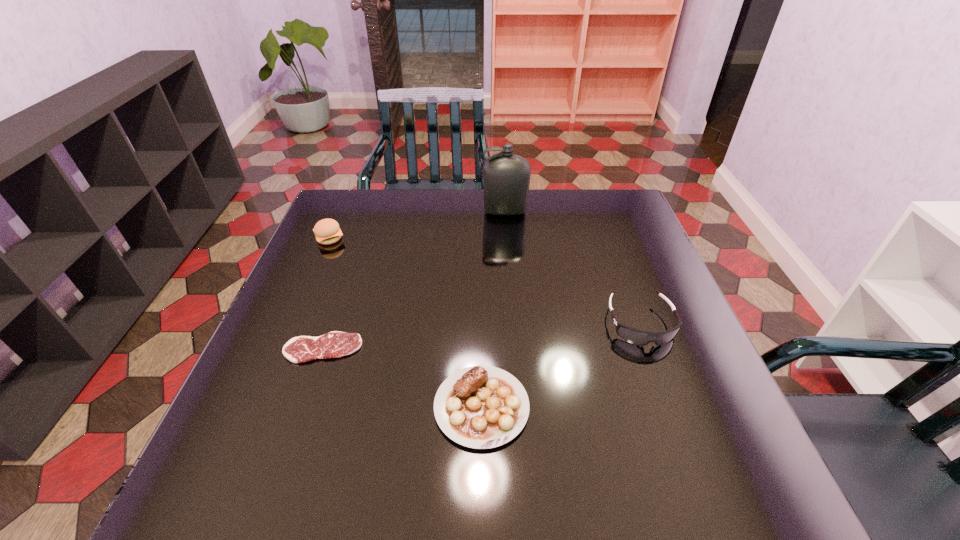
You are a GUI agent. You are given a task and a screenshot of the screen. Output one action in this format:
    pyautogui.click(x=<x>, y=<y>)
    Task: Click on the free space between the bottle and the farther steak
    
    Given the screenshot: What is the action you would take?
    pyautogui.click(x=414, y=280)

Image resolution: width=960 pixels, height=540 pixels. I want to click on vacant area that lies between the nearer steak and the shortest object, so click(402, 377).

Identify the location of free space between the shortest object and the bottle. (414, 280).

Find the location of a particular element. The width and height of the screenshot is (960, 540). empty space that is in between the second shortest object and the shorter steak is located at coordinates (402, 377).

Image resolution: width=960 pixels, height=540 pixels. Find the location of `object that is the third closest to the nearest object`. object that is the third closest to the nearest object is located at coordinates click(x=327, y=231).

Find the location of a particular element. the closest object to the shorter steak is located at coordinates (481, 407).

The height and width of the screenshot is (540, 960). Identify the location of vacant position in the image that satisfies the following two spatial constraints: 1. on the back side of the farthest object; 2. on the right side of the farther steak. (370, 212).